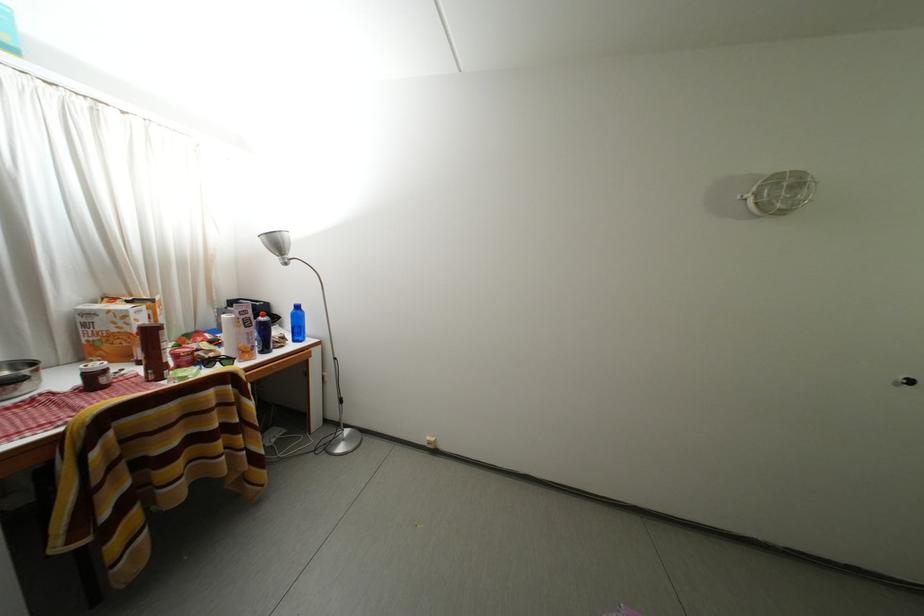
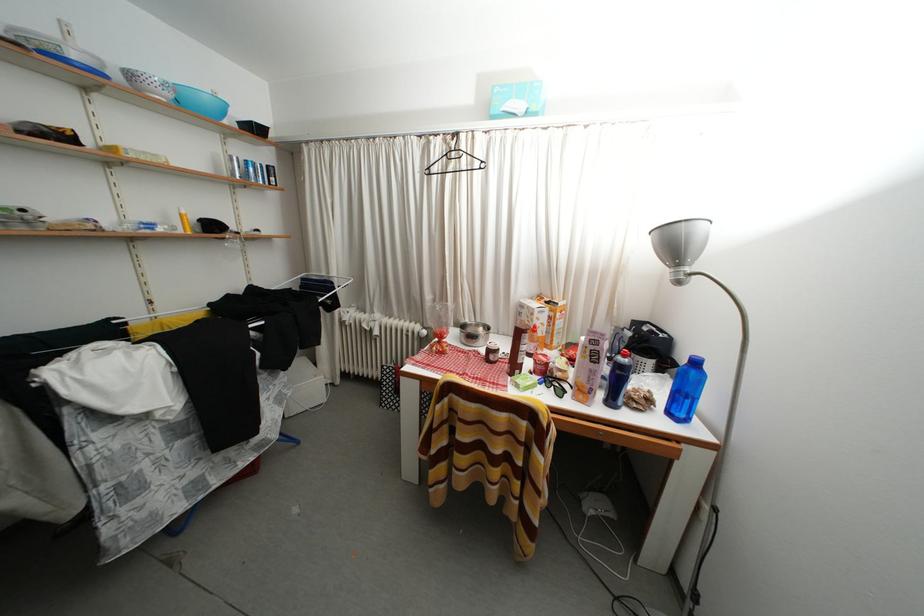
In the second image, find the point that corresponds to (x=98, y=318) in the first image.

(529, 310)